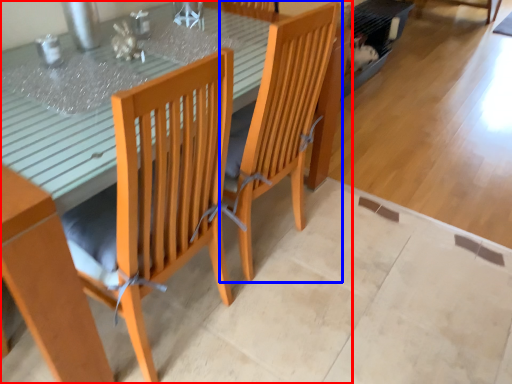
Question: Which point is further to the camera, table (highlighted by a red box) or chair (highlighted by a blue box)?

Choices:
 (A) table
 (B) chair

Answer: (B)